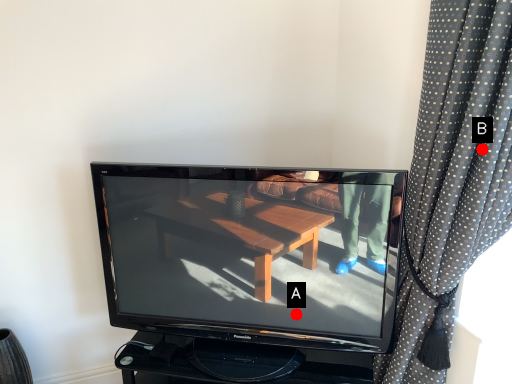
Question: Two points are circled on the image, labeled by A and B beside each circle. Among these points, which one is nearest to the camera?

Choices:
 (A) A is closer
 (B) B is closer

Answer: (B)